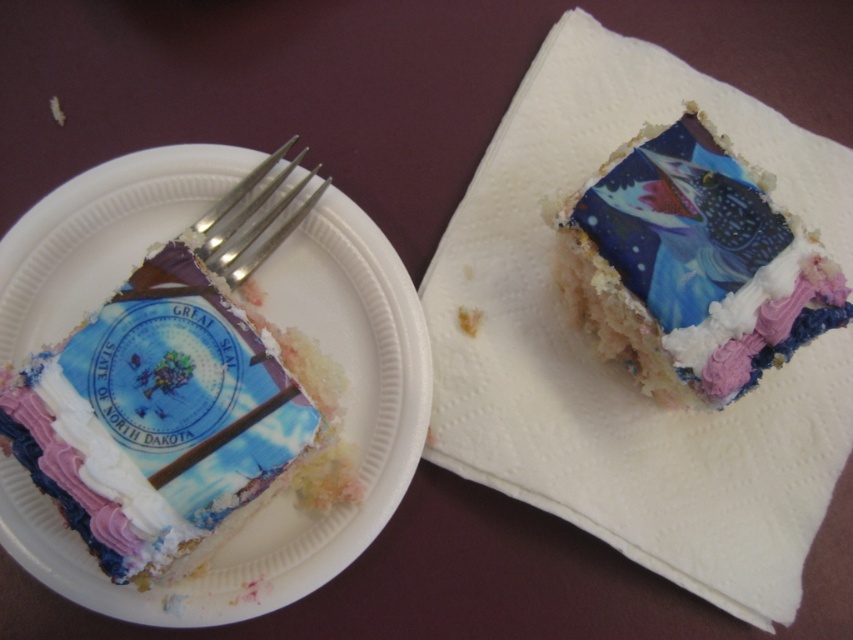
Question: Among these points, which one is farthest from the camera?

Choices:
 (A) (711, 324)
 (B) (222, 250)

Answer: (B)

Question: Is matte white cake at left thinner than shiny blue cake at upper right?

Choices:
 (A) no
 (B) yes

Answer: (A)

Question: Is silver metallic fork at upper left to the left of purple cream frosting at upper right from the viewer's perspective?

Choices:
 (A) yes
 (B) no

Answer: (A)

Question: Is shiny blue cake at upper right to the left of silver metallic fork at upper left from the viewer's perspective?

Choices:
 (A) no
 (B) yes

Answer: (A)

Question: Considering the real-world distances, which object is closest to the shiny blue cake at upper right?

Choices:
 (A) matte white cake at left
 (B) silver metallic fork at upper left
 (C) purple cream frosting at upper right

Answer: (C)

Question: Which object is closer to the camera taking this photo?

Choices:
 (A) shiny blue cake at upper right
 (B) silver metallic fork at upper left

Answer: (B)